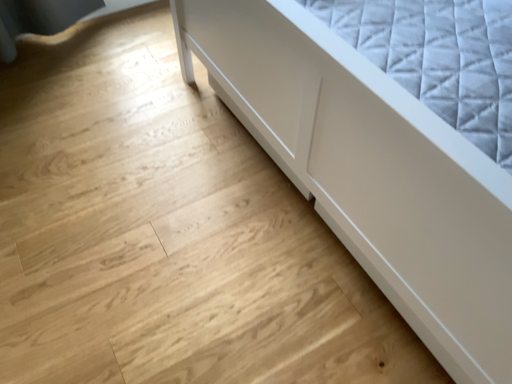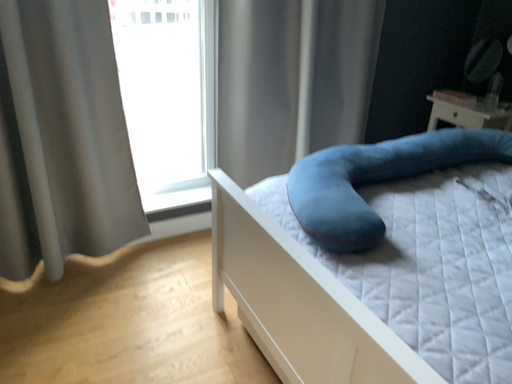
Question: How did the camera likely rotate when shooting the video?

Choices:
 (A) rotated upward
 (B) rotated downward

Answer: (A)